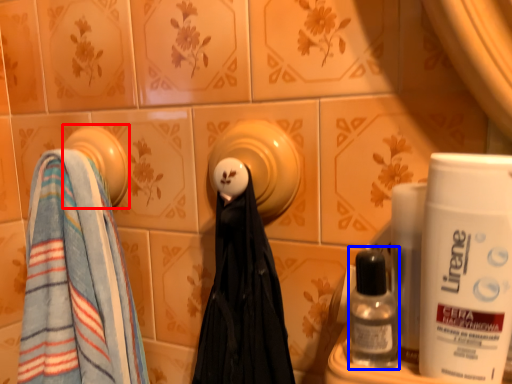
Question: Which object is closer to the camera taking this photo, towel (highlighted by a red box) or mouthwash (highlighted by a blue box)?

Choices:
 (A) towel
 (B) mouthwash

Answer: (B)